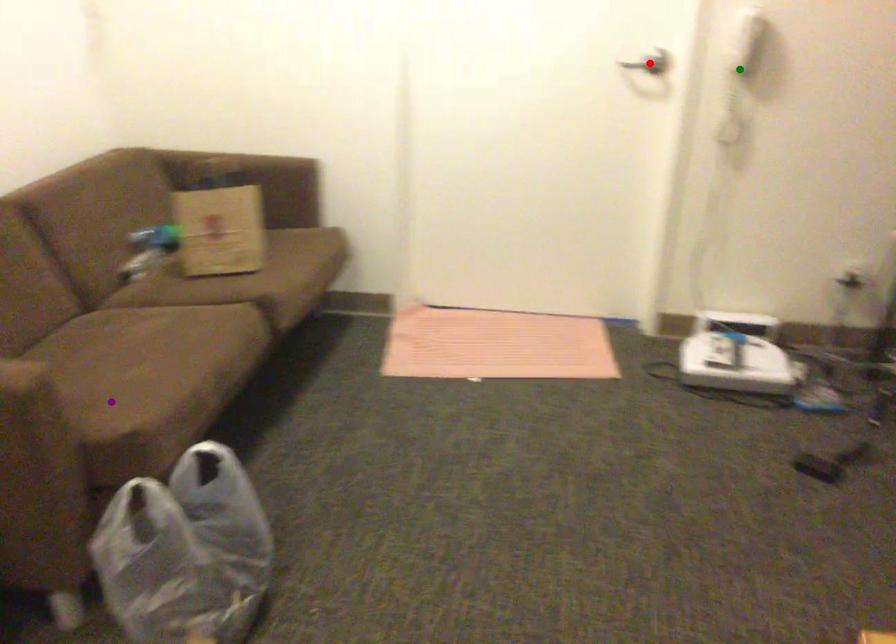
Order these from farthest to nearest:
- green point
- red point
- purple point

1. red point
2. green point
3. purple point